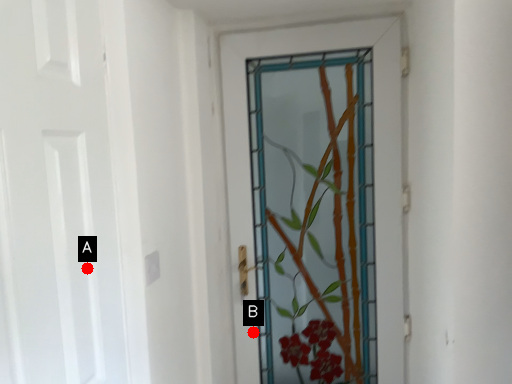
Question: Two points are circled on the image, labeled by A and B beside each circle. Which point is further to the camera?

Choices:
 (A) A is further
 (B) B is further

Answer: (B)